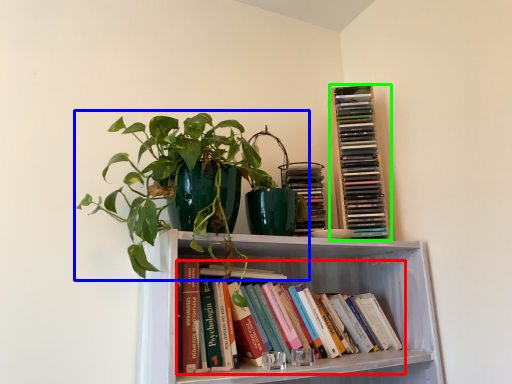
Question: Which object is the farthest from book (highlighted by a red box)? Choose among these: houseplant (highlighted by a blue box) or book (highlighted by a green box).

Choices:
 (A) houseplant
 (B) book

Answer: (A)